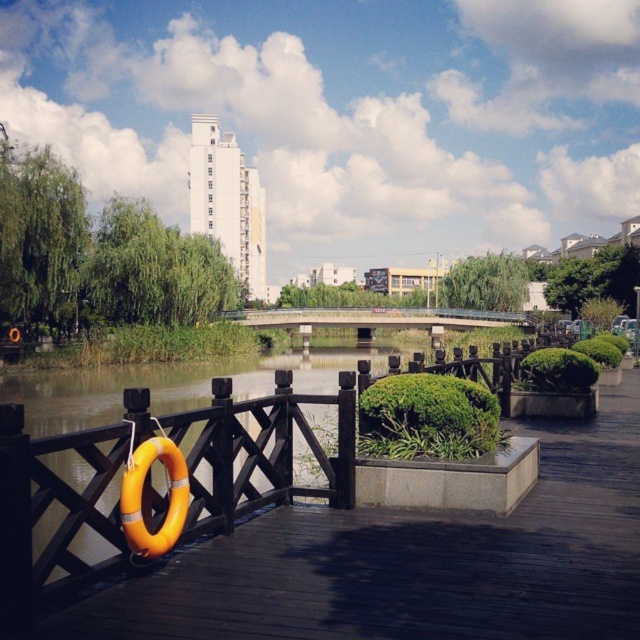
Question: Which of the following is the closest to the observer?

Choices:
 (A) (353, 518)
 (B) (403, 310)

Answer: (A)

Question: Is orange rubber ring at left to the right of concrete bridge at center from the viewer's perspective?

Choices:
 (A) yes
 (B) no

Answer: (B)

Question: Can you confirm if orange rubber ring at left is positioned to the right of concrete bridge at center?

Choices:
 (A) no
 (B) yes

Answer: (A)

Question: Is orange rubber ring at left wider than concrete bridge at center?

Choices:
 (A) no
 (B) yes

Answer: (A)